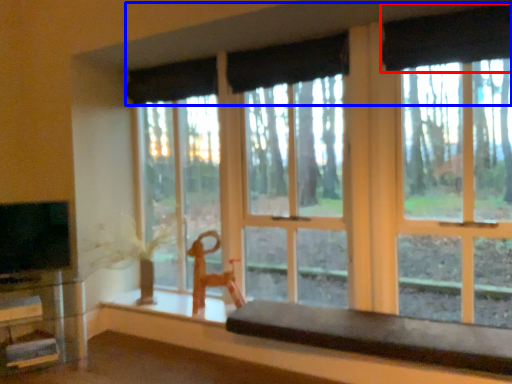
Question: Which of the following is the farthest to the observer, curtain (highlighted by a red box) or curtain (highlighted by a blue box)?

Choices:
 (A) curtain
 (B) curtain

Answer: (A)